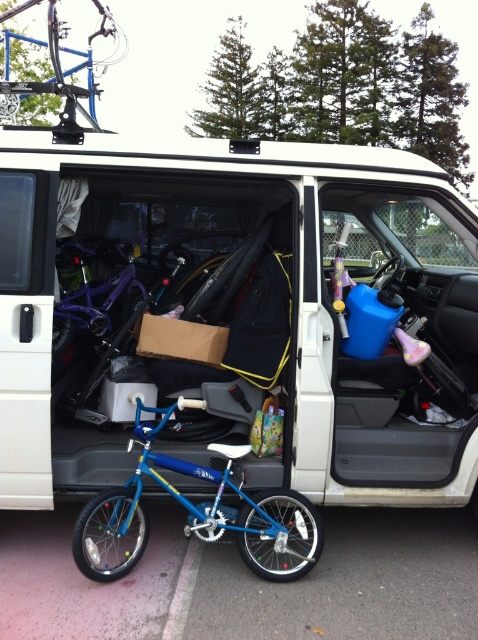
Consider the image. Is blue matte bicycle at center taller than shiny purple bicycle at center?

No.

Does blue matte bicycle at center have a larger size compared to shiny purple bicycle at center?

Indeed, blue matte bicycle at center has a larger size compared to shiny purple bicycle at center.

Which is behind, point (141, 524) or point (98, 284)?

The point (98, 284) is behind.

Where is `blue matte bicycle at center`? This screenshot has height=640, width=478. blue matte bicycle at center is located at coordinates (196, 515).

Can you confirm if white matte van at center is positioned to the left of shiny purple bicycle at center?

In fact, white matte van at center is to the right of shiny purple bicycle at center.

Find the location of a particular element. The image size is (478, 640). white matte van at center is located at coordinates (236, 316).

At what (x,y) coordinates should I click in order to perform the action: click on white matte van at center. Please return your answer as a coordinate pair (x, y). Image resolution: width=478 pixels, height=640 pixels. Looking at the image, I should click on (236, 316).

Describe the element at coordinates (236, 316) in the screenshot. This screenshot has width=478, height=640. I see `white matte van at center` at that location.

Does point (344, 236) come farther from viewer compared to point (230, 516)?

Yes, point (344, 236) is farther from viewer.

You are a GUI agent. You are given a task and a screenshot of the screen. Output one action in this format:
    pyautogui.click(x=<x>, y=<y>)
    Task: Click on the white matte van at center
    
    Given the screenshot: What is the action you would take?
    pyautogui.click(x=236, y=316)